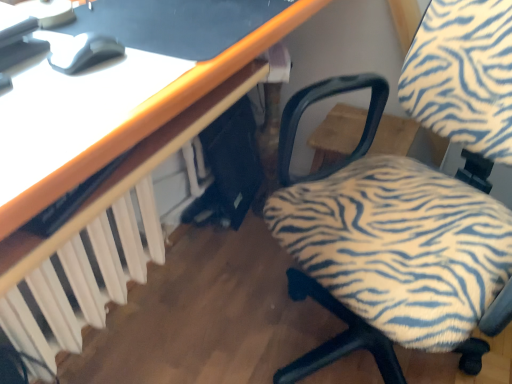
Measure the distance between point (83, 53) and camera.

Point (83, 53) is 24.92 inches from camera.

Looking at this image, measure the distance between white plastic radiator at lower left and camera.

white plastic radiator at lower left and camera are 30.12 inches apart.

The width and height of the screenshot is (512, 384). What do you see at coordinates (337, 337) in the screenshot? I see `zebra-patterned fabric chair at center-right` at bounding box center [337, 337].

The height and width of the screenshot is (384, 512). I want to click on matte gray mouse at upper left, so click(84, 52).

Is white plastic radiator at lower left facing away from zebra-patterned fabric chair at center-right?

white plastic radiator at lower left is not turned away from zebra-patterned fabric chair at center-right.

In the scene shown: In terms of size, does white plastic radiator at lower left appear bigger or smaller than zebra-patterned fabric chair at center-right?

Considering their sizes, white plastic radiator at lower left takes up less space than zebra-patterned fabric chair at center-right.

Is white plastic radiator at lower left placed right next to zebra-patterned fabric chair at center-right?

There is a gap between white plastic radiator at lower left and zebra-patterned fabric chair at center-right.

Which is behind, point (99, 222) or point (457, 109)?

Positioned behind is point (99, 222).

Is zebra-patterned fabric chair at center-right oriented away from white plastic radiator at lower left?

No, white plastic radiator at lower left is not at the back of zebra-patterned fabric chair at center-right.

From a real-world perspective, which is physically below, zebra-patterned fabric chair at center-right or white plastic radiator at lower left?

In real-world perspective, white plastic radiator at lower left is lower.

Consider the image. Between zebra-patterned fabric chair at center-right and white plastic radiator at lower left, which one is positioned in front?

zebra-patterned fabric chair at center-right is in front.

Is zebra-patterned fabric chair at center-right next to white plastic radiator at lower left?

No, zebra-patterned fabric chair at center-right is not in contact with white plastic radiator at lower left.

Considering their positions, is white plastic radiator at lower left located in front of or behind matte gray mouse at upper left?

In the image, white plastic radiator at lower left appears behind matte gray mouse at upper left.

Looking at this image, between white plastic radiator at lower left and matte gray mouse at upper left, which one has larger width?

white plastic radiator at lower left is wider.

Is matte gray mouse at upper left located within white plastic radiator at lower left?

Actually, matte gray mouse at upper left is outside white plastic radiator at lower left.

Based on the photo, based on their sizes in the image, would you say white plastic radiator at lower left is bigger or smaller than matte gray mouse at upper left?

white plastic radiator at lower left is bigger than matte gray mouse at upper left.

Which of these two, zebra-patterned fabric chair at center-right or matte gray mouse at upper left, stands shorter?

matte gray mouse at upper left is shorter.

From the image's perspective, is zebra-patterned fabric chair at center-right located above matte gray mouse at upper left?

No, from the image's perspective, zebra-patterned fabric chair at center-right is not above matte gray mouse at upper left.

Does zebra-patterned fabric chair at center-right appear on the left side of matte gray mouse at upper left?

No.

Consider the image. Can you tell me how much zebra-patterned fabric chair at center-right and matte gray mouse at upper left differ in facing direction?

→ zebra-patterned fabric chair at center-right and matte gray mouse at upper left are facing 99.3 degrees away from each other.

Are matte gray mouse at upper left and zebra-patterned fabric chair at center-right far apart?

That's not correct — matte gray mouse at upper left is a little close to zebra-patterned fabric chair at center-right.

Considering the sizes of objects matte gray mouse at upper left and zebra-patterned fabric chair at center-right in the image provided, who is wider, matte gray mouse at upper left or zebra-patterned fabric chair at center-right?

With larger width is zebra-patterned fabric chair at center-right.

Is matte gray mouse at upper left to the left or to the right of zebra-patterned fabric chair at center-right in the image?

Based on their positions, matte gray mouse at upper left is located to the left of zebra-patterned fabric chair at center-right.

Is matte gray mouse at upper left facing away from zebra-patterned fabric chair at center-right?

That's not correct — matte gray mouse at upper left is not looking away from zebra-patterned fabric chair at center-right.

From a real-world perspective, is matte gray mouse at upper left beneath white plastic radiator at lower left?

No, from a real-world perspective, matte gray mouse at upper left is not under white plastic radiator at lower left.

Is point (90, 51) closer to viewer compared to point (133, 217)?

Yes, it is.

In terms of height, does matte gray mouse at upper left look taller or shorter compared to white plastic radiator at lower left?

matte gray mouse at upper left is shorter than white plastic radiator at lower left.

From the image's perspective, is matte gray mouse at upper left above or below white plastic radiator at lower left?

Clearly, from the image's perspective, matte gray mouse at upper left is above white plastic radiator at lower left.

The height and width of the screenshot is (384, 512). Find the location of `chair that is above the white plastic radiator at lower left (from a real-world perspective)`. chair that is above the white plastic radiator at lower left (from a real-world perspective) is located at coordinates (337, 337).

The width and height of the screenshot is (512, 384). Identify the location of radiator below the zebra-patterned fabric chair at center-right (from the image's perspective). (62, 287).

From the image, which object appears to be nearer to white plastic radiator at lower left, zebra-patterned fabric chair at center-right or matte gray mouse at upper left?

Among the two, matte gray mouse at upper left is located nearer to white plastic radiator at lower left.

Based on their spatial positions, is matte gray mouse at upper left or zebra-patterned fabric chair at center-right closer to white plastic radiator at lower left?

Among the two, matte gray mouse at upper left is located nearer to white plastic radiator at lower left.

Estimate the real-world distances between objects in this image. Which object is closer to zebra-patterned fabric chair at center-right, white plastic radiator at lower left or matte gray mouse at upper left?

matte gray mouse at upper left is closer to zebra-patterned fabric chair at center-right.

In the scene shown: Which object lies nearer to the anchor point matte gray mouse at upper left, white plastic radiator at lower left or zebra-patterned fabric chair at center-right?

Based on the image, white plastic radiator at lower left appears to be nearer to matte gray mouse at upper left.

Looking at the image, which one is located further to matte gray mouse at upper left, zebra-patterned fabric chair at center-right or white plastic radiator at lower left?

zebra-patterned fabric chair at center-right is further to matte gray mouse at upper left.

When comparing their distances from zebra-patterned fabric chair at center-right, does matte gray mouse at upper left or white plastic radiator at lower left seem closer?

matte gray mouse at upper left.

Where is `mouse between white plastic radiator at lower left and zebra-patterned fabric chair at center-right`? The height and width of the screenshot is (384, 512). mouse between white plastic radiator at lower left and zebra-patterned fabric chair at center-right is located at coordinates (84, 52).